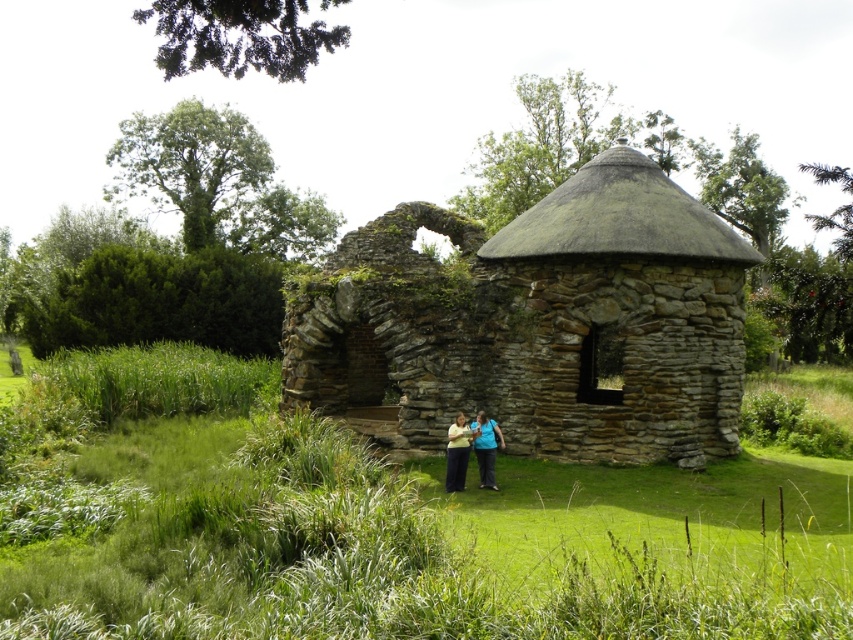
Question: Estimate the real-world distances between objects in this image. Which object is closer to the blue denim jeans at center?

Choices:
 (A) green grass at center
 (B) rustic stone ruins at center

Answer: (A)

Question: Which object appears farthest from the camera in this image?

Choices:
 (A) green grass at center
 (B) dark blue fabric at center

Answer: (B)

Question: Does green grass at center have a lesser width compared to dark blue fabric at center?

Choices:
 (A) yes
 (B) no

Answer: (B)

Question: Based on their relative distances, which object is farther from the dark blue fabric at center?

Choices:
 (A) blue denim jeans at center
 (B) green grass at center
 (C) rustic stone ruins at center

Answer: (C)

Question: Can you confirm if green grass at center is positioned to the left of rustic stone ruins at center?

Choices:
 (A) yes
 (B) no

Answer: (A)

Question: Is rustic stone ruins at center to the left of blue denim jeans at center from the viewer's perspective?

Choices:
 (A) no
 (B) yes

Answer: (A)